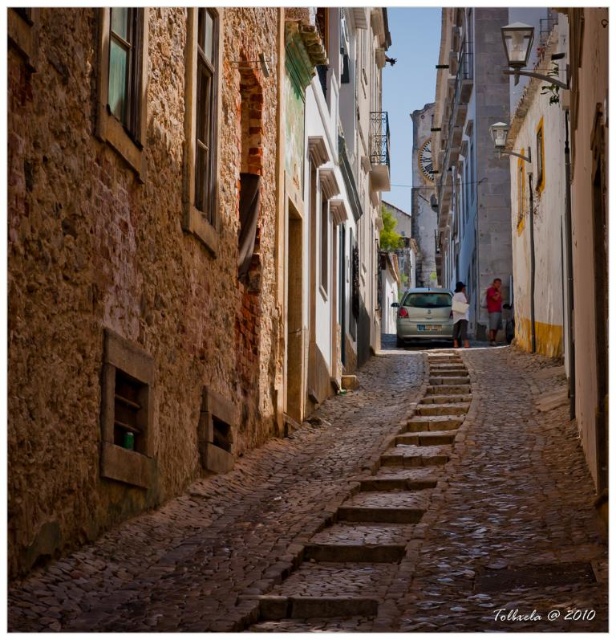
You are a delivery person carrying a heavy package and need to reach the light beige metallic car at center. The brown cobblestone stairs at center are in your way. Can you go around them to reach the car without climbing the stairs?

The brown cobblestone stairs at center are located below the light beige metallic car at center, so you can go around the stairs by approaching the car from above the stairs on the higher ground to avoid climbing them.

You are a tour guide leading a group down the narrow cobblestone street. You want to point out both the brown cobblestone stairs at center and the light beige metallic car at center. Which one is closer to your current position as you stand at the lower part of the street?

The brown cobblestone stairs at center is in front of the light beige metallic car at center, so the stairs are closer to your current position at the lower part of the street.

Based on the photo, you are a tour guide leading a group through the historic cobblestone street. You want to point out both the brown cobblestone path at center and the light beige metallic car at center. Which one is positioned to the left side of the other?

The brown cobblestone path at center is to the left of light beige metallic car at center.